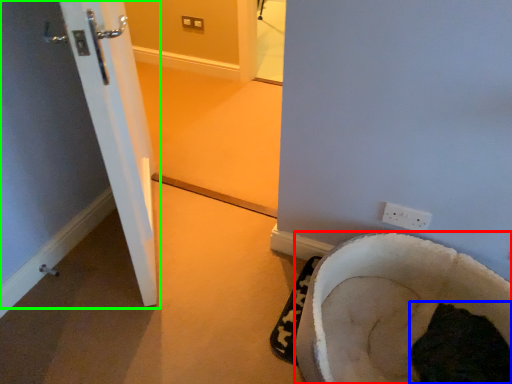
Question: Considering the real-world distances, which object is closest to furniture (highlighted by a red box)? animal (highlighted by a blue box) or door (highlighted by a green box).

Choices:
 (A) animal
 (B) door

Answer: (A)